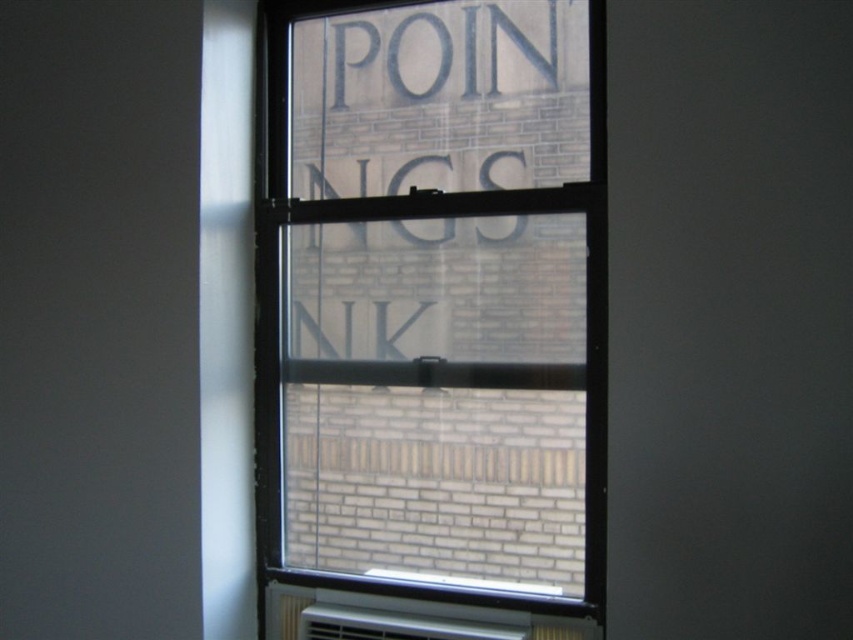
Question: Which point is farther from the camera taking this photo?

Choices:
 (A) (287, 616)
 (B) (495, 56)

Answer: (A)

Question: Does clear glass window at center have a lesser width compared to white plastic radiator at bottom?

Choices:
 (A) no
 (B) yes

Answer: (A)

Question: Which of the following is the closest to the observer?

Choices:
 (A) (585, 444)
 (B) (410, 600)

Answer: (A)

Question: Which object is closer to the camera taking this photo?

Choices:
 (A) clear glass window at center
 (B) white plastic radiator at bottom

Answer: (A)

Question: Is clear glass window at center further to camera compared to white plastic radiator at bottom?

Choices:
 (A) no
 (B) yes

Answer: (A)

Question: Is clear glass window at center smaller than white plastic radiator at bottom?

Choices:
 (A) no
 (B) yes

Answer: (A)